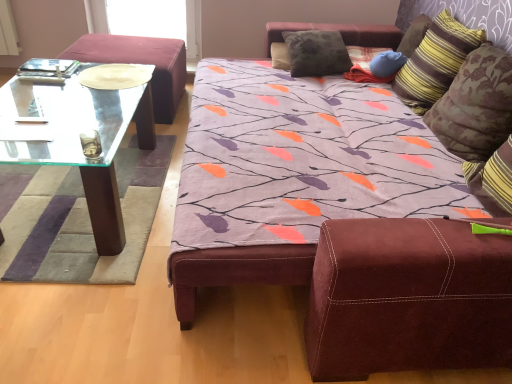
What do you see at coordinates (140, 63) in the screenshot? The width and height of the screenshot is (512, 384). I see `velvet burgundy ottoman at left` at bounding box center [140, 63].

From the picture: How much space does striped fabric pillow at upper right, marked as the second pillow in a right-to-left arrangement, occupy vertically?

18.62 inches.

Measure the distance between blue fabric pillow at upper right, which is counted as the second pillow, starting from the left, and camera.

The depth of blue fabric pillow at upper right, which is counted as the second pillow, starting from the left, is 2.56 meters.

What is the approximate height of blue fabric pillow at upper right, which appears as the 3th pillow when viewed from the right?

6.70 inches.

Where is `striped fabric pillow at upper right, placed as the fourth pillow when sorted from left to right`? striped fabric pillow at upper right, placed as the fourth pillow when sorted from left to right is located at coordinates (476, 106).

In order to face velvety gray pillow at upper center, positioned as the first pillow in left-to-right order, should I rotate leftwards or rightwards?

To align with it, rotate right about 6.221°.

Locate an element on the screen. Image resolution: width=512 pixels, height=384 pixels. velvet burgundy ottoman at left is located at coordinates (140, 63).

Between striped fabric pillow at upper right, the 1th pillow positioned from the right, and striped fabric pillow at upper right, marked as the second pillow in a right-to-left arrangement, which one appears on the right side from the viewer's perspective?

Positioned to the right is striped fabric pillow at upper right, the 1th pillow positioned from the right.

How far apart are striped fabric pillow at upper right, placed as the fourth pillow when sorted from left to right, and striped fabric pillow at upper right, which is the 3th pillow from left to right?

11.79 inches.

In the scene shown: Can you tell me how much striped fabric pillow at upper right, the 1th pillow positioned from the right, and striped fabric pillow at upper right, marked as the second pillow in a right-to-left arrangement, differ in facing direction?

There is a 4.05e-05-degree angle between the facing directions of striped fabric pillow at upper right, the 1th pillow positioned from the right, and striped fabric pillow at upper right, marked as the second pillow in a right-to-left arrangement.

From a real-world perspective, is striped fabric pillow at upper right, placed as the fourth pillow when sorted from left to right, above or below striped fabric pillow at upper right, which is the 3th pillow from left to right?

striped fabric pillow at upper right, placed as the fourth pillow when sorted from left to right, is situated lower than striped fabric pillow at upper right, which is the 3th pillow from left to right, in the real world.

From the image's perspective, is velvety gray pillow at upper center, positioned as the first pillow in left-to-right order, beneath velvet burgundy ottoman at left?

No.

Does point (321, 33) come closer to viewer compared to point (158, 42)?

Yes, point (321, 33) is in front of point (158, 42).

Is velvety gray pillow at upper center, positioned as the first pillow in left-to-right order, to the left of velvet burgundy ottoman at left from the viewer's perspective?

No.

Is velvety gray pillow at upper center, positioned as the first pillow in left-to-right order, turned away from velvet burgundy ottoman at left?

No, velvety gray pillow at upper center, positioned as the first pillow in left-to-right order, is not facing the opposite direction of velvet burgundy ottoman at left.

Identify the location of coffee table below the velvet burgundy ottoman at left (from a real-world perspective). The width and height of the screenshot is (512, 384). (80, 141).

Considering the sizes of velvet burgundy ottoman at left and transparent glass coffee table at left in the image, is velvet burgundy ottoman at left taller or shorter than transparent glass coffee table at left?

Considering their sizes, velvet burgundy ottoman at left has more height than transparent glass coffee table at left.

Considering the sizes of objects velvet burgundy ottoman at left and transparent glass coffee table at left in the image provided, who is thinner, velvet burgundy ottoman at left or transparent glass coffee table at left?

velvet burgundy ottoman at left.

Is velvet burgundy ottoman at left oriented away from transparent glass coffee table at left?

That's not correct — velvet burgundy ottoman at left is not looking away from transparent glass coffee table at left.

Which is closer, [41,84] or [381,54]?

Point [41,84] is closer to the camera than point [381,54].

Looking at this image, from the image's perspective, which is above, transparent glass coffee table at left or blue fabric pillow at upper right, which appears as the 3th pillow when viewed from the right?

From the image's view, blue fabric pillow at upper right, which appears as the 3th pillow when viewed from the right, is above.

Consider the image. Is the depth of transparent glass coffee table at left greater than that of blue fabric pillow at upper right, which is counted as the second pillow, starting from the left?

No, it is in front of blue fabric pillow at upper right, which is counted as the second pillow, starting from the left.

Is transparent glass coffee table at left taller than blue fabric pillow at upper right, which appears as the 3th pillow when viewed from the right?

Incorrect, the height of transparent glass coffee table at left is not larger of that of blue fabric pillow at upper right, which appears as the 3th pillow when viewed from the right.

Can you confirm if blue fabric pillow at upper right, which is counted as the second pillow, starting from the left, is shorter than transparent glass coffee table at left?

No, blue fabric pillow at upper right, which is counted as the second pillow, starting from the left, is not shorter than transparent glass coffee table at left.

From a real-world perspective, is blue fabric pillow at upper right, which appears as the 3th pillow when viewed from the right, physically below transparent glass coffee table at left?

Actually, blue fabric pillow at upper right, which appears as the 3th pillow when viewed from the right, is physically above transparent glass coffee table at left in the real world.

Considering the sizes of objects blue fabric pillow at upper right, which appears as the 3th pillow when viewed from the right, and transparent glass coffee table at left in the image provided, who is thinner, blue fabric pillow at upper right, which appears as the 3th pillow when viewed from the right, or transparent glass coffee table at left?

blue fabric pillow at upper right, which appears as the 3th pillow when viewed from the right.

From a real-world perspective, starting from the transparent glass coffee table at left, which pillow is the 4th one vertically above it? Please provide its 2D coordinates.

[(435, 61)]

How many degrees apart are the facing directions of transparent glass coffee table at left and striped fabric pillow at upper right, which is the 3th pillow from left to right?

The angle between the facing direction of transparent glass coffee table at left and the facing direction of striped fabric pillow at upper right, which is the 3th pillow from left to right, is 88.1 degrees.

In the scene shown: From the image's perspective, which object appears higher, transparent glass coffee table at left or striped fabric pillow at upper right, which is the 3th pillow from left to right?

From the image's view, striped fabric pillow at upper right, which is the 3th pillow from left to right, is above.

Does velvety gray pillow at upper center, positioned as the first pillow in left-to-right order, appear on the left side of striped fabric pillow at upper right, which is the 3th pillow from left to right?

Correct, you'll find velvety gray pillow at upper center, positioned as the first pillow in left-to-right order, to the left of striped fabric pillow at upper right, which is the 3th pillow from left to right.

Considering the sizes of velvety gray pillow at upper center, positioned as the 4th pillow in right-to-left order, and striped fabric pillow at upper right, marked as the second pillow in a right-to-left arrangement, in the image, is velvety gray pillow at upper center, positioned as the 4th pillow in right-to-left order, bigger or smaller than striped fabric pillow at upper right, marked as the second pillow in a right-to-left arrangement,?

In the image, velvety gray pillow at upper center, positioned as the 4th pillow in right-to-left order, appears to be smaller than striped fabric pillow at upper right, marked as the second pillow in a right-to-left arrangement.

From a real-world perspective, starting from the velvety gray pillow at upper center, positioned as the first pillow in left-to-right order, which pillow is the 3rd one vertically above it? Please provide its 2D coordinates.

[(435, 61)]

Can you confirm if velvety gray pillow at upper center, positioned as the first pillow in left-to-right order, is shorter than striped fabric pillow at upper right, which is the 3th pillow from left to right?

Correct, velvety gray pillow at upper center, positioned as the first pillow in left-to-right order, is not as tall as striped fabric pillow at upper right, which is the 3th pillow from left to right.

Starting from the striped fabric pillow at upper right, the 1th pillow positioned from the right, which pillow is the 1st one behind? Please provide its 2D coordinates.

[(435, 61)]

I want to click on couch located underneath the velvety gray pillow at upper center, positioned as the 4th pillow in right-to-left order (from a real-world perspective), so click(x=140, y=63).

Which object lies nearer to the anchor point blue fabric pillow at upper right, which appears as the 3th pillow when viewed from the right, velvet burgundy ottoman at left or striped fabric pillow at upper right, which is the 3th pillow from left to right?

striped fabric pillow at upper right, which is the 3th pillow from left to right, is closer to blue fabric pillow at upper right, which appears as the 3th pillow when viewed from the right.

Considering their positions, is velvety gray pillow at upper center, positioned as the 4th pillow in right-to-left order, positioned further to transparent glass coffee table at left than striped fabric pillow at upper right, the 1th pillow positioned from the right?

striped fabric pillow at upper right, the 1th pillow positioned from the right, lies further to transparent glass coffee table at left than the other object.

Estimate the real-world distances between objects in this image. Which object is closer to striped fabric pillow at upper right, which is the 3th pillow from left to right, velvet burgundy ottoman at left or striped fabric pillow at upper right, the 1th pillow positioned from the right?

striped fabric pillow at upper right, the 1th pillow positioned from the right, lies closer to striped fabric pillow at upper right, which is the 3th pillow from left to right, than the other object.

Considering their positions, is striped fabric pillow at upper right, which is the 3th pillow from left to right, positioned closer to striped fabric pillow at upper right, the 1th pillow positioned from the right, than transparent glass coffee table at left?

striped fabric pillow at upper right, which is the 3th pillow from left to right.

Considering their positions, is transparent glass coffee table at left positioned closer to striped fabric pillow at upper right, the 1th pillow positioned from the right, than striped fabric pillow at upper right, marked as the second pillow in a right-to-left arrangement?

The object closer to striped fabric pillow at upper right, the 1th pillow positioned from the right, is striped fabric pillow at upper right, marked as the second pillow in a right-to-left arrangement.

Which object lies nearer to the anchor point velvety gray pillow at upper center, positioned as the first pillow in left-to-right order, transparent glass coffee table at left or blue fabric pillow at upper right, which appears as the 3th pillow when viewed from the right?

blue fabric pillow at upper right, which appears as the 3th pillow when viewed from the right, lies closer to velvety gray pillow at upper center, positioned as the first pillow in left-to-right order, than the other object.

From the image, which object appears to be nearer to transparent glass coffee table at left, blue fabric pillow at upper right, which appears as the 3th pillow when viewed from the right, or velvety gray pillow at upper center, positioned as the first pillow in left-to-right order?

velvety gray pillow at upper center, positioned as the first pillow in left-to-right order, is positioned closer to the anchor transparent glass coffee table at left.

Which object lies nearer to the anchor point velvety gray pillow at upper center, positioned as the first pillow in left-to-right order, transparent glass coffee table at left or striped fabric pillow at upper right, the 1th pillow positioned from the right?

Among the two, striped fabric pillow at upper right, the 1th pillow positioned from the right, is located nearer to velvety gray pillow at upper center, positioned as the first pillow in left-to-right order.

I want to click on couch between transparent glass coffee table at left and striped fabric pillow at upper right, placed as the fourth pillow when sorted from left to right, so click(140, 63).

Find the location of `couch between transparent glass coffee table at left and velvety gray pillow at upper center, positioned as the first pillow in left-to-right order, in the horizontal direction`. couch between transparent glass coffee table at left and velvety gray pillow at upper center, positioned as the first pillow in left-to-right order, in the horizontal direction is located at coordinates (140, 63).

Where is `pillow between striped fabric pillow at upper right, placed as the fourth pillow when sorted from left to right, and blue fabric pillow at upper right, which is counted as the second pillow, starting from the left, in the front-back direction`? This screenshot has width=512, height=384. pillow between striped fabric pillow at upper right, placed as the fourth pillow when sorted from left to right, and blue fabric pillow at upper right, which is counted as the second pillow, starting from the left, in the front-back direction is located at coordinates (435, 61).

Identify the location of couch located between transparent glass coffee table at left and striped fabric pillow at upper right, marked as the second pillow in a right-to-left arrangement, in the left-right direction. Image resolution: width=512 pixels, height=384 pixels. (140, 63).